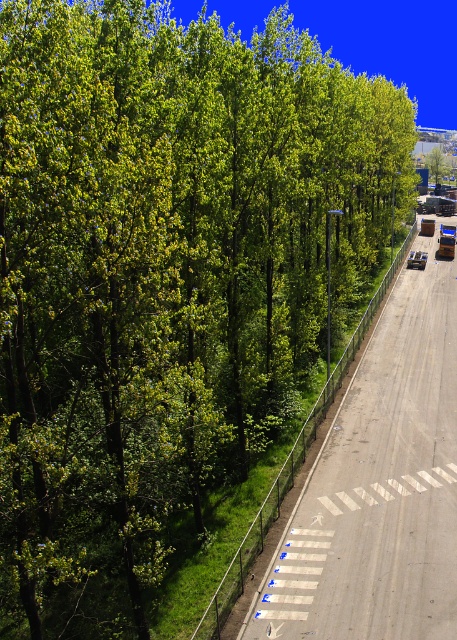
You are a pedestrian standing at the edge of the asphalt road at center. You want to walk to the green leafy tree at center. Which direction should you walk to reach it?

The asphalt road at center is in front of the green leafy tree at center, so you should walk towards the green leafy tree at center by moving forward from the asphalt road at center.

You are a driver approaching the intersection where the asphalt road at center and the green leafy tree at center are located. You need to determine if you can safely pass under the tree without hitting it. Can you confirm if the road is tall enough for your vehicle?

The asphalt road at center has a lesser height compared to green leafy tree at center, so the road itself does not have a height restriction. However, the green leafy tree at center is taller than the road, so if your vehicle has a high clearance, you may need to check the tree branches or any overhead obstructions to ensure safe passage.